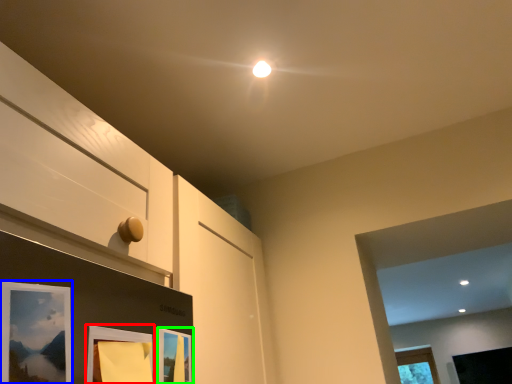
Question: Which is nearer to the picture frame (highlighted by a red box)? picture frame (highlighted by a blue box) or picture frame (highlighted by a green box).

Choices:
 (A) picture frame
 (B) picture frame

Answer: (B)